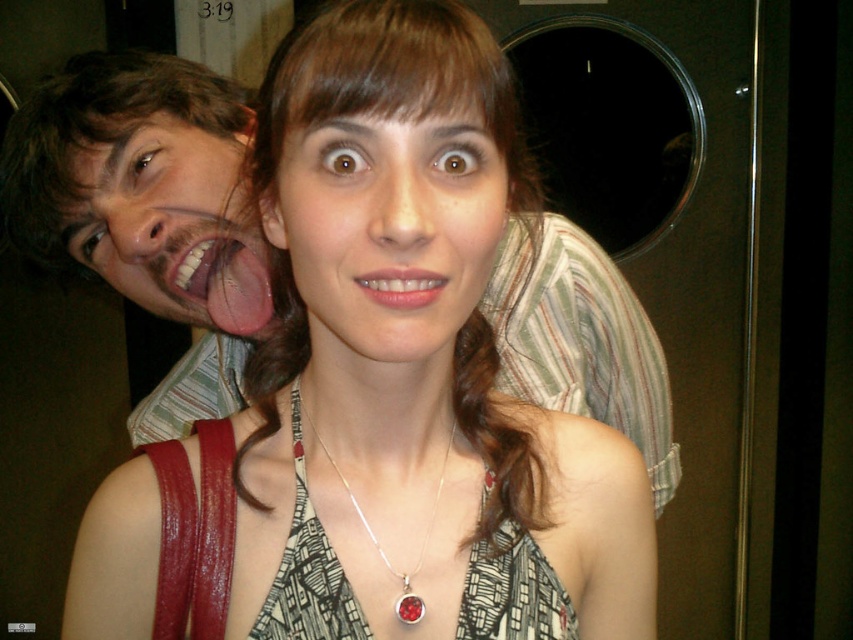
What is located at the coordinates point (308, 576)?

The printed fabric dress at center is located at point (308, 576).